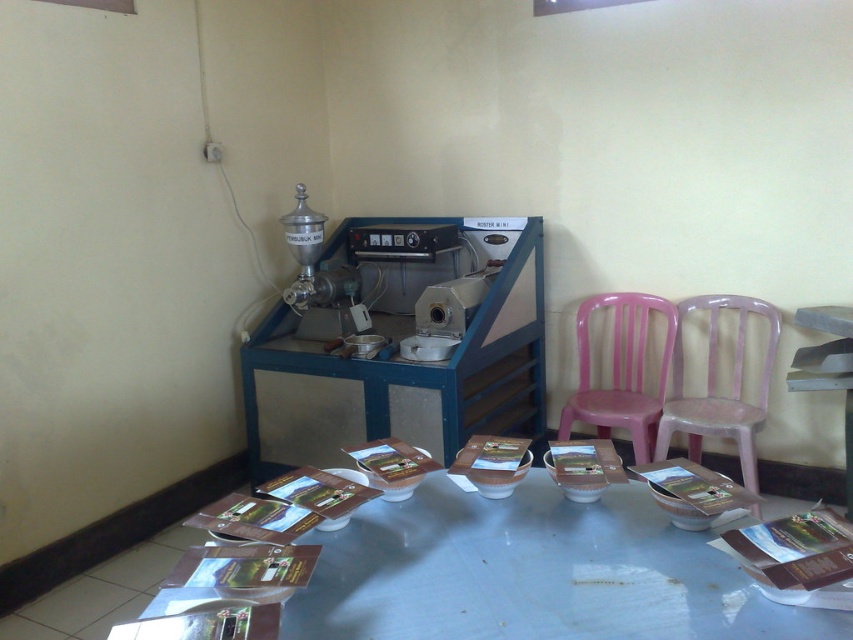
You are organizing a small event in the room and need to place a rectangular tablecloth that is 1.2 meters wide. You have two options available to place it on either the white glossy table at center or the pink plastic chair at right. Based on the scene description, which object can accommodate the tablecloth without it hanging off the edges?

The white glossy table at center can accommodate the tablecloth since its width is larger than the pink plastic chair at right, making it more likely to fit the 1.2 meter wide tablecloth.

You are standing in the room and need to move from the pink plastic chair at center to the pink plastic chair at right. Which direction should you move relative to the machine?

Since the pink plastic chair at center is above the pink plastic chair at right, you should move downward relative to the machine to reach the pink plastic chair at right.